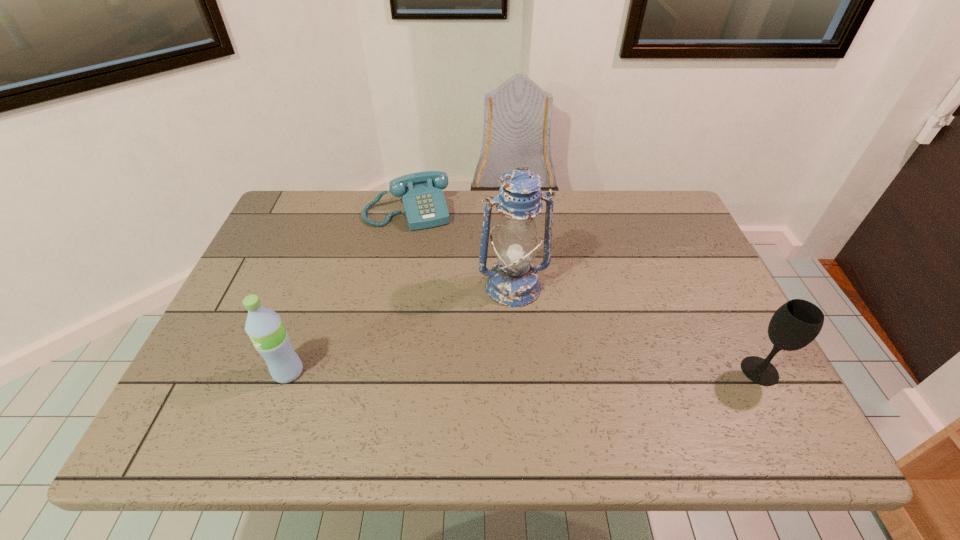
Where is `vacant area that satisfies the following two spatial constraints: 1. on the front side of the second object from left to right; 2. on the right side of the tallest object`? This screenshot has width=960, height=540. vacant area that satisfies the following two spatial constraints: 1. on the front side of the second object from left to right; 2. on the right side of the tallest object is located at coordinates (393, 286).

Find the location of a particular element. The height and width of the screenshot is (540, 960). free space that satisfies the following two spatial constraints: 1. on the front side of the third object from left to right; 2. on the left side of the shortest object is located at coordinates (393, 286).

Locate an element on the screen. free space that satisfies the following two spatial constraints: 1. on the back side of the third object from right to left; 2. on the right side of the second tallest object is located at coordinates (346, 211).

Where is `free space that satisfies the following two spatial constraints: 1. on the front side of the tallest object; 2. on the right side of the rightmost object`? Image resolution: width=960 pixels, height=540 pixels. free space that satisfies the following two spatial constraints: 1. on the front side of the tallest object; 2. on the right side of the rightmost object is located at coordinates (519, 371).